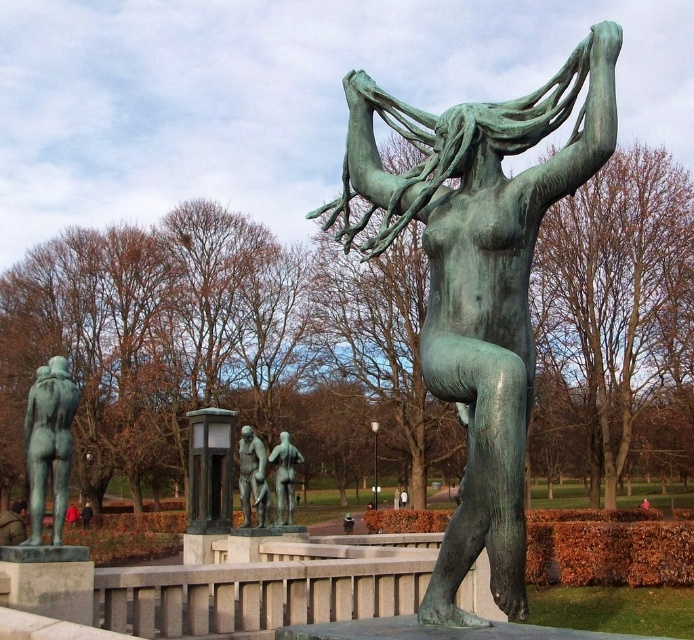
Question: Is green polished statue at left behind bronze statue at center?

Choices:
 (A) no
 (B) yes

Answer: (A)

Question: Which point is farther from the camera taking this photo?

Choices:
 (A) (559, 93)
 (B) (17, 509)

Answer: (B)

Question: Is green patina bronze statue at center thinner than bronze statue at center?

Choices:
 (A) yes
 (B) no

Answer: (B)

Question: Which point is farther from the camera taking this photo?

Choices:
 (A) (17, 502)
 (B) (248, 522)
 (C) (28, 458)

Answer: (A)

Question: Is green patina bronze statue at center to the right of bronze nude figure at center from the viewer's perspective?

Choices:
 (A) no
 (B) yes

Answer: (B)

Question: Among these objects, which one is farthest from the camera?

Choices:
 (A) bronze statue at center
 (B) green polished statue at left
 (C) bronze nude figure at center

Answer: (C)